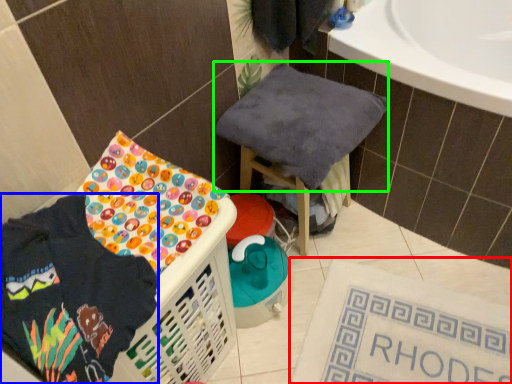
Question: Which object is the farthest from bath mat (highlighted by a red box)? Choose among these: clothing (highlighted by a blue box) or baby clothe (highlighted by a green box).

Choices:
 (A) clothing
 (B) baby clothe

Answer: (A)